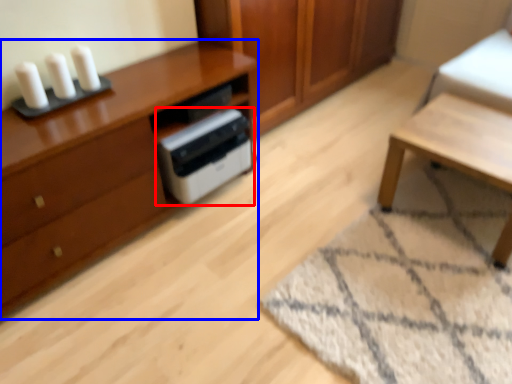
Question: Which point is further to the camera, home appliance (highlighted by a red box) or chest of drawers (highlighted by a blue box)?

Choices:
 (A) home appliance
 (B) chest of drawers

Answer: (A)